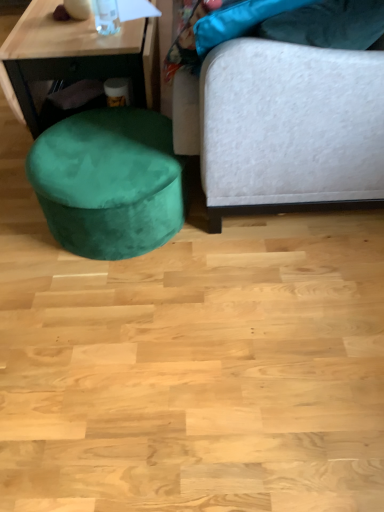
Locate an element on the screen. This screenshot has width=384, height=512. vacant space situated on the left part of transparent glass bottle at upper left is located at coordinates (74, 29).